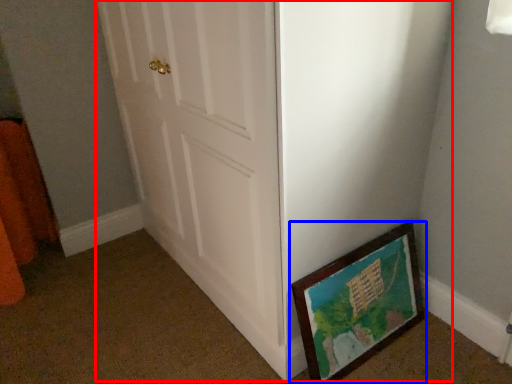
Question: Among these objects, which one is farthest to the camera, door (highlighted by a red box) or picture frame (highlighted by a blue box)?

Choices:
 (A) door
 (B) picture frame

Answer: (B)